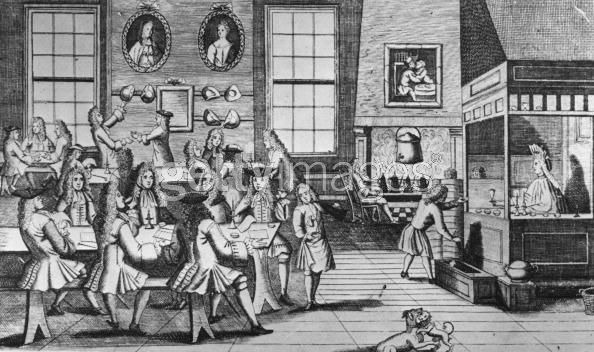
Image resolution: width=594 pixels, height=352 pixels. Find the location of `portraits`. portraits is located at coordinates (147, 33), (220, 31).